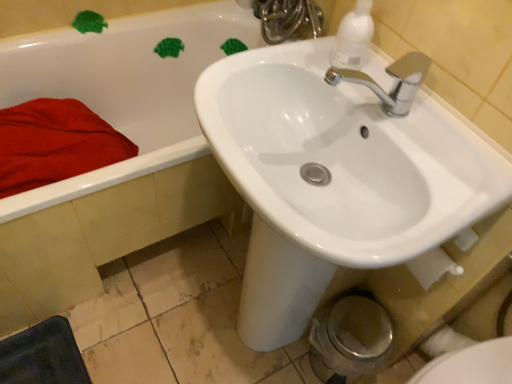
What do you see at coordinates (471, 365) in the screenshot? The image size is (512, 384). I see `white glossy bidet at lower right` at bounding box center [471, 365].

This screenshot has height=384, width=512. Find the location of `white glossy bidet at lower right`. white glossy bidet at lower right is located at coordinates (471, 365).

What is the approximate height of white glossy faucet at upper center?

white glossy faucet at upper center is 16.76 centimeters tall.

Describe the element at coordinates (288, 20) in the screenshot. I see `white glossy faucet at upper center` at that location.

What is the approximate width of white glossy sink at upper center?

white glossy sink at upper center is 17.11 inches in width.

Identify the location of white glossy bathtub at upper left. (124, 87).

Would you say white glossy sink at upper center contains red soft towel at left?

No, red soft towel at left is located outside of white glossy sink at upper center.

From a real-world perspective, is white glossy sink at upper center beneath red soft towel at left?

No, from a real-world perspective, white glossy sink at upper center is not under red soft towel at left.

Looking at this image, which of these two, white glossy sink at upper center or red soft towel at left, stands taller?

white glossy sink at upper center.

Image resolution: width=512 pixels, height=384 pixels. Find the location of `bath towel below the white glossy sink at upper center (from a real-world perspective)`. bath towel below the white glossy sink at upper center (from a real-world perspective) is located at coordinates (55, 144).

Considering the positions of objects white plastic soap dispenser at upper right and white glossy bidet at lower right in the image provided, who is more to the left, white plastic soap dispenser at upper right or white glossy bidet at lower right?

white plastic soap dispenser at upper right.

The width and height of the screenshot is (512, 384). What are the coordinates of `soap dispenser on the left of white glossy bidet at lower right` in the screenshot? It's located at (353, 37).

Which object is further away from the camera, white plastic soap dispenser at upper right or white glossy bidet at lower right?

Positioned behind is white plastic soap dispenser at upper right.

Looking at the image, does white plastic soap dispenser at upper right seem bigger or smaller compared to white glossy bidet at lower right?

white plastic soap dispenser at upper right is smaller than white glossy bidet at lower right.

From the picture: Considering the relative sizes of white glossy sink at upper center and white plastic soap dispenser at upper right in the image provided, is white glossy sink at upper center bigger than white plastic soap dispenser at upper right?

Yes.

Is white glossy sink at upper center thinner than white plastic soap dispenser at upper right?

No, white glossy sink at upper center is not thinner than white plastic soap dispenser at upper right.

Identify the location of sink that is in front of the white plastic soap dispenser at upper right. (337, 182).

Between red soft towel at left and white glossy bathtub at upper left, which one has smaller width?

red soft towel at left.

Which is less distant, (29, 166) or (130, 119)?

Point (29, 166) is positioned closer to the camera compared to point (130, 119).

Considering the sizes of objects red soft towel at left and white glossy bathtub at upper left in the image provided, who is shorter, red soft towel at left or white glossy bathtub at upper left?

red soft towel at left is shorter.

Does red soft towel at left touch white glossy bathtub at upper left?

They are not placed beside each other.

The width and height of the screenshot is (512, 384). What are the coordinates of `sink that is on the left side of white glossy bidet at lower right` in the screenshot? It's located at (337, 182).

Is white glossy sink at upper center turned away from white glossy bidet at lower right?

white glossy sink at upper center does not have its back to white glossy bidet at lower right.

Choose the correct answer: Is white glossy sink at upper center inside white glossy bidet at lower right or outside it?

white glossy sink at upper center is not enclosed by white glossy bidet at lower right.

Looking at their sizes, would you say white glossy sink at upper center is wider or thinner than white glossy bidet at lower right?

Considering their sizes, white glossy sink at upper center looks slimmer than white glossy bidet at lower right.

Considering the relative positions of white glossy faucet at upper center and white glossy bathtub at upper left in the image provided, is white glossy faucet at upper center to the left of white glossy bathtub at upper left from the viewer's perspective?

In fact, white glossy faucet at upper center is to the right of white glossy bathtub at upper left.

From the image's perspective, is white glossy faucet at upper center located above or below white glossy bathtub at upper left?

white glossy faucet at upper center is situated higher than white glossy bathtub at upper left in the image.

Measure the distance from white glossy faucet at upper center to white glossy bathtub at upper left.

A distance of 14.47 inches exists between white glossy faucet at upper center and white glossy bathtub at upper left.

From the picture: Is white glossy faucet at upper center aimed at white glossy sink at upper center?

No, white glossy faucet at upper center is not oriented towards white glossy sink at upper center.

Can you confirm if white glossy faucet at upper center is bigger than white glossy sink at upper center?

No.

Considering their positions, is white glossy faucet at upper center located in front of or behind white glossy sink at upper center?

white glossy faucet at upper center is behind white glossy sink at upper center.

Is white glossy sink at upper center surrounded by white glossy faucet at upper center?

No, white glossy sink at upper center is not inside white glossy faucet at upper center.

This screenshot has width=512, height=384. In order to click on bath towel located above the white glossy sink at upper center (from the image's perspective) in this screenshot , I will do `click(55, 144)`.

Find the location of a particular element. The height and width of the screenshot is (384, 512). soap dispenser lying on the left of white glossy bidet at lower right is located at coordinates (353, 37).

Which object lies further to the anchor point white plastic soap dispenser at upper right, red soft towel at left or white glossy bidet at lower right?

red soft towel at left is positioned further to the anchor white plastic soap dispenser at upper right.

From the image, which object appears to be nearer to white plastic soap dispenser at upper right, red soft towel at left or white glossy bathtub at upper left?

The object closer to white plastic soap dispenser at upper right is red soft towel at left.

When comparing their distances from white plastic soap dispenser at upper right, does red soft towel at left or white glossy faucet at upper center seem further?

The object further to white plastic soap dispenser at upper right is red soft towel at left.

Considering their positions, is red soft towel at left positioned closer to white glossy bathtub at upper left than white plastic soap dispenser at upper right?

red soft towel at left is closer to white glossy bathtub at upper left.

Consider the image. Looking at the image, which one is located further to white glossy bathtub at upper left, white glossy bidet at lower right or red soft towel at left?

Based on the image, white glossy bidet at lower right appears to be further to white glossy bathtub at upper left.

Considering their positions, is white glossy bathtub at upper left positioned closer to white glossy bidet at lower right than white plastic soap dispenser at upper right?

white plastic soap dispenser at upper right is closer to white glossy bidet at lower right.

When comparing their distances from white glossy faucet at upper center, does white glossy bidet at lower right or white glossy bathtub at upper left seem further?

Among the two, white glossy bidet at lower right is located further to white glossy faucet at upper center.

Estimate the real-world distances between objects in this image. Which object is closer to white glossy faucet at upper center, white glossy bathtub at upper left or white plastic soap dispenser at upper right?

The object closer to white glossy faucet at upper center is white glossy bathtub at upper left.

Locate an element on the screen. sink situated between red soft towel at left and white plastic soap dispenser at upper right from left to right is located at coordinates (337, 182).

This screenshot has width=512, height=384. In order to click on sink between white glossy bidet at lower right and white glossy faucet at upper center along the z-axis in this screenshot , I will do `click(337, 182)`.

The height and width of the screenshot is (384, 512). I want to click on soap dispenser located between red soft towel at left and white glossy bidet at lower right in the left-right direction, so click(353, 37).

Identify the location of sink between white glossy bathtub at upper left and white glossy bidet at lower right from left to right. Image resolution: width=512 pixels, height=384 pixels. (337, 182).